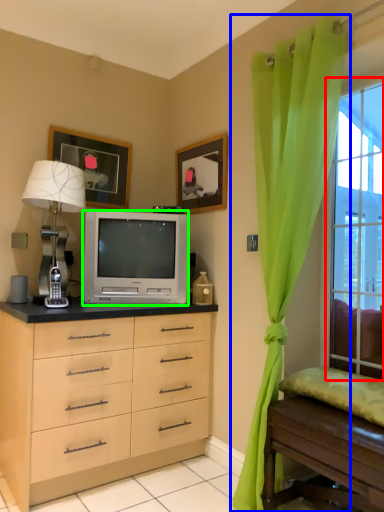
Question: Based on their relative distances, which object is nearer to window (highlighted by a red box)? Choose from curtain (highlighted by a blue box) and television (highlighted by a green box).

Choices:
 (A) curtain
 (B) television

Answer: (A)